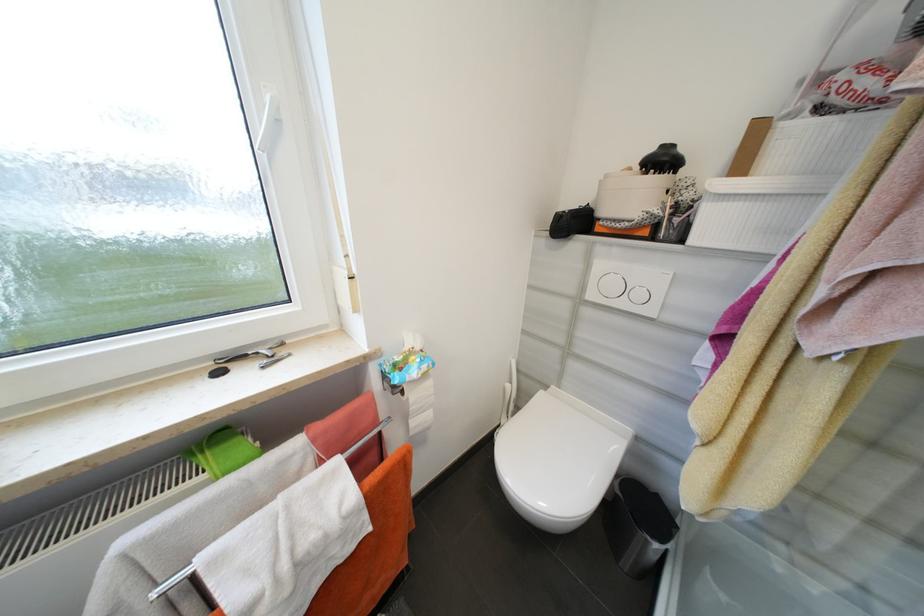
Find where to press the large flush button. Please return your answer as a coordinate pair (x, y).

(609, 283)